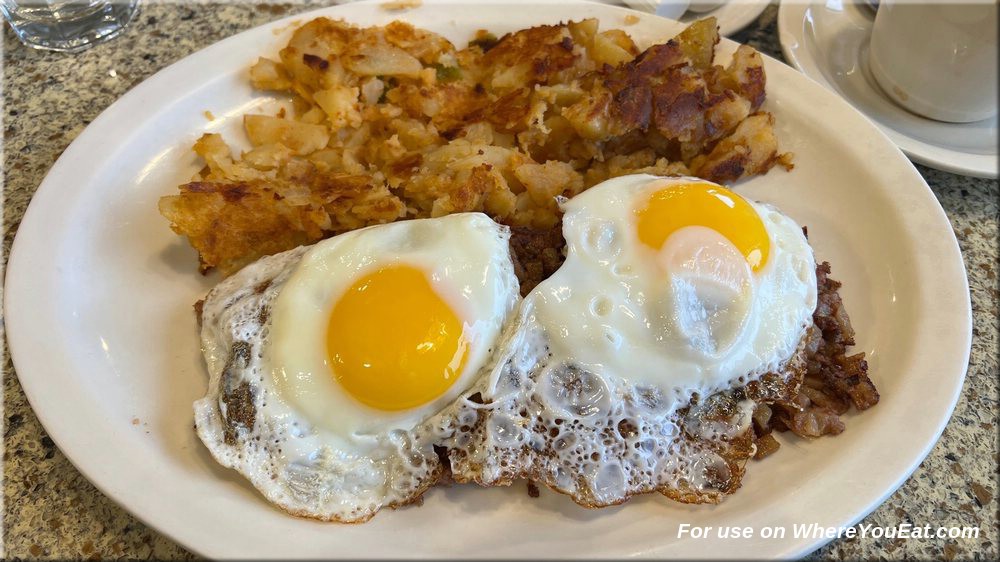
Where is `table`? Image resolution: width=1000 pixels, height=562 pixels. table is located at coordinates (73, 513).